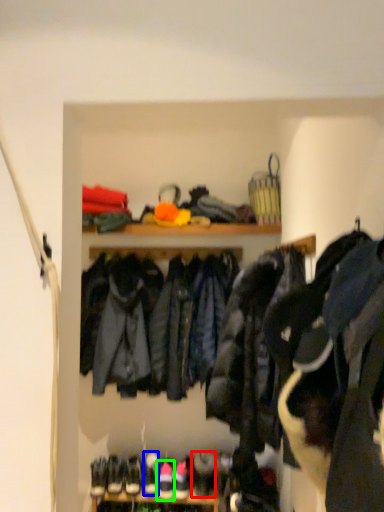
Question: Which object is positioned closest to shoe (highlighted by a red box)? Select from footwear (highlighted by a blue box) and footwear (highlighted by a green box).

Choices:
 (A) footwear
 (B) footwear

Answer: (B)